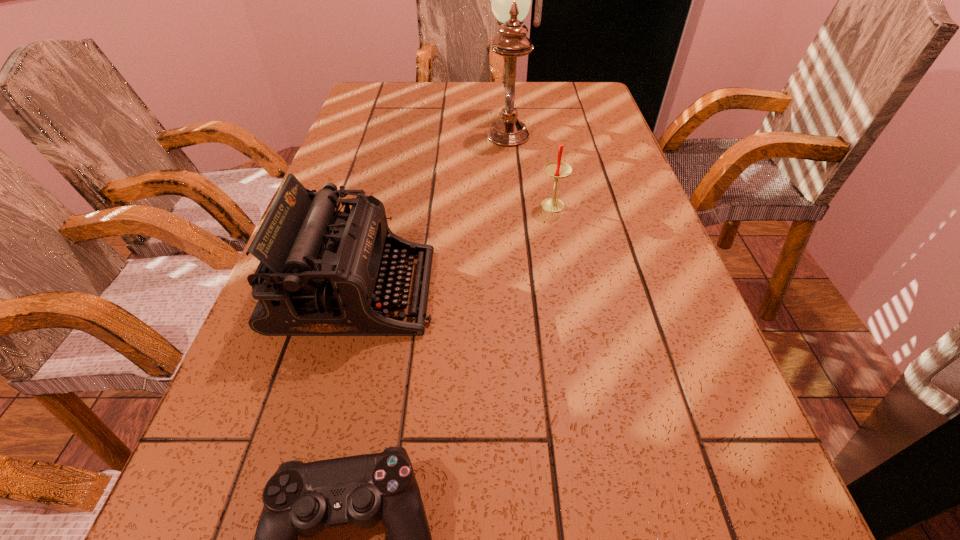
You are a GUI agent. You are given a task and a screenshot of the screen. Output one action in this format:
    pyautogui.click(x=<x>, y=<y>)
    Task: Click on the oil lamp
    The image size is (960, 540).
    Given the screenshot: What is the action you would take?
    pyautogui.click(x=510, y=0)

The width and height of the screenshot is (960, 540). What are the coordinates of `the tallest object` in the screenshot? It's located at (510, 0).

You are a GUI agent. You are given a task and a screenshot of the screen. Output one action in this format:
    pyautogui.click(x=<x>, y=<y>)
    Task: Click on the typewriter
    The height and width of the screenshot is (540, 960).
    Given the screenshot: What is the action you would take?
    pyautogui.click(x=322, y=271)

The image size is (960, 540). Identify the location of the third farthest object. (322, 271).

Find the location of a particular element. The height and width of the screenshot is (540, 960). candle is located at coordinates (557, 169).

At what (x,y) coordinates should I click in order to perform the action: click on the second farthest object. Please return your answer as a coordinate pair (x, y). The height and width of the screenshot is (540, 960). Looking at the image, I should click on (557, 169).

Locate an element on the screen. vacant space located on the left of the farthest object is located at coordinates (394, 126).

Where is `vacant space located on the keyboard of the typewriter`? vacant space located on the keyboard of the typewriter is located at coordinates (495, 291).

Image resolution: width=960 pixels, height=540 pixels. Find the location of `free location located on the front of the third nearest object`. free location located on the front of the third nearest object is located at coordinates (564, 267).

Locate an element on the screen. object that is at the far edge is located at coordinates (510, 0).